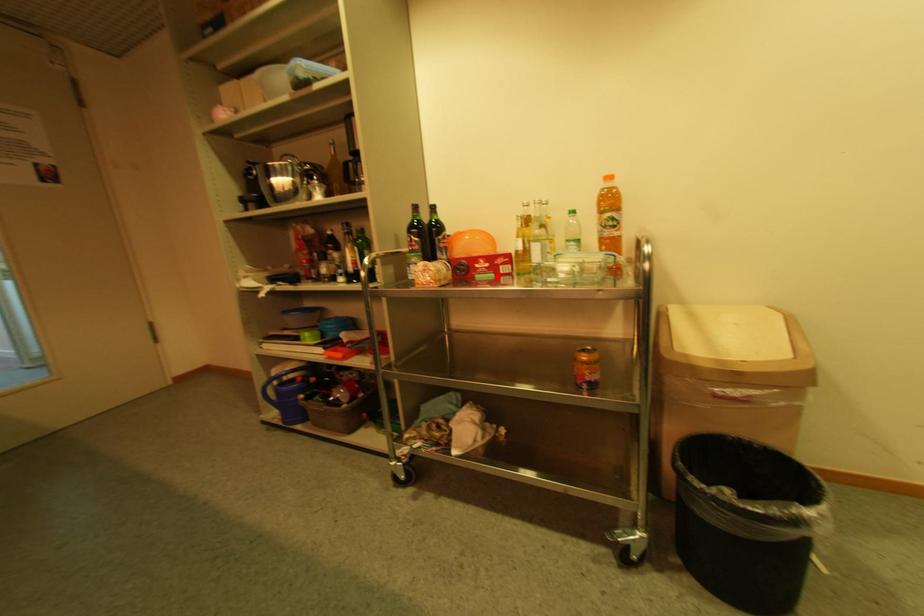
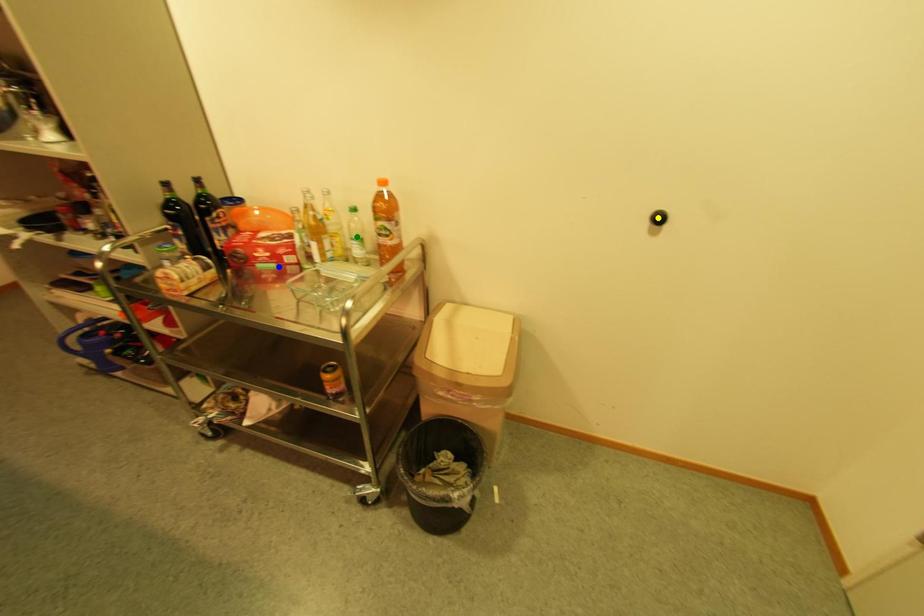
Question: I am providing you with two images of the same scene from different viewpoints. A red point is marked on the first image. You are given multiple points on the second image. Which point in image 2 represents the same 3d spot as the red point in image 1?

Choices:
 (A) green point
 (B) yellow point
 (C) blue point

Answer: (C)